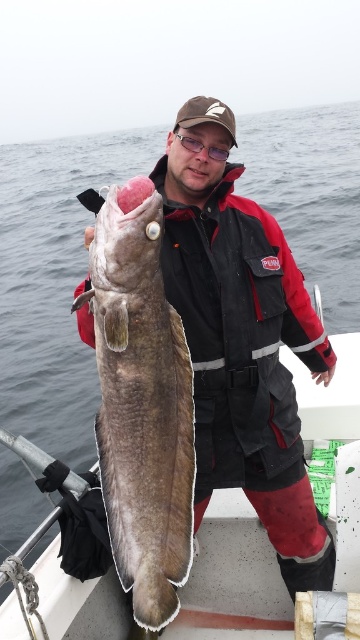
You are a photographer trying to capture the exact position of the dark gray textured fish at center in this image. According to the coordinates provided, where should you focus your camera lens?

The dark gray textured fish at center is located at point 0.630 on the x axis and 0.392 on the y axis. To capture its exact position, focus the camera lens at coordinates [141,403].

You are a photographer taking a picture of the scene. You need to focus on the black fabric jacket at center and the smooth plastic boat at center. Which object should you adjust your camera focus to first if you want to capture both clearly?

The black fabric jacket at center is positioned on the right side of smooth plastic boat at center, so you should focus on the smooth plastic boat at center first since it is closer to the camera and then adjust focus to the black fabric jacket at center.